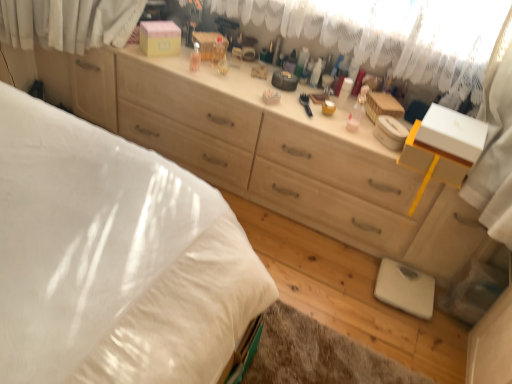
Question: From the image's perspective, is matte plastic container at center, placed as the first toiletry when sorted from right to left, above or below transparent plastic bottle at center, arranged as the 3th toiletry when viewed from the right?

Choices:
 (A) above
 (B) below

Answer: (B)

Question: Is matte plastic container at center, placed as the first toiletry when sorted from right to left, spatially inside transparent plastic bottle at center, arranged as the 3th toiletry when viewed from the right, or outside of it?

Choices:
 (A) outside
 (B) inside

Answer: (A)

Question: Which object is the farthest from the matte plastic container at center, placed as the first toiletry when sorted from right to left?

Choices:
 (A) white soft bed at lower left
 (B) white plastic container at center, placed as the 2th toiletry when sorted from left to right
 (C) transparent plastic bottle at center, which is counted as the 1th toiletry, starting from the left
 (D) white lace curtain at upper center

Answer: (A)

Question: Estimate the real-world distances between objects in this image. Which object is farther from the white plastic container at center, placed as the 2th toiletry when sorted from left to right?

Choices:
 (A) white soft bed at lower left
 (B) matte plastic container at center, the 3th toiletry when ordered from left to right
 (C) white lace curtain at upper center
 (D) transparent plastic bottle at center, arranged as the 3th toiletry when viewed from the right

Answer: (A)